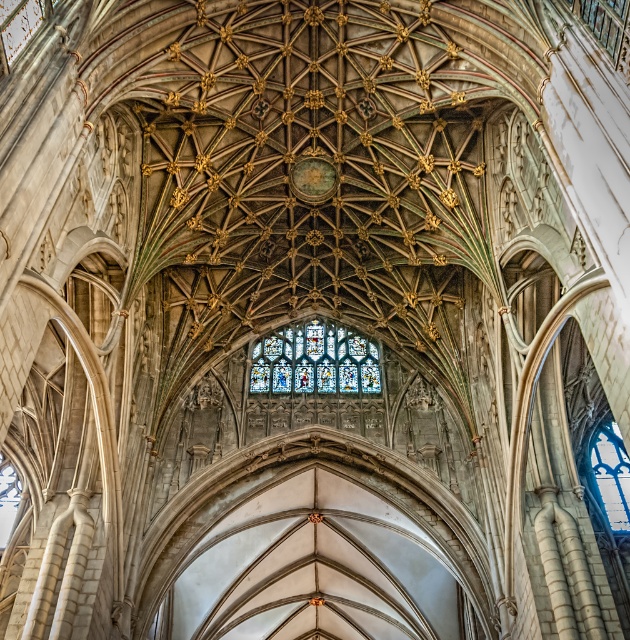
Between point (360, 378) and point (616, 442), which one is positioned in front?

Positioned in front is point (616, 442).

Between stained glass at center and blue glass window at center, which one has more height?

With more height is blue glass window at center.

Who is more forward, [299,356] or [610,474]?

Positioned in front is point [610,474].

Image resolution: width=630 pixels, height=640 pixels. Find the location of `stained glass at center`. stained glass at center is located at coordinates (315, 360).